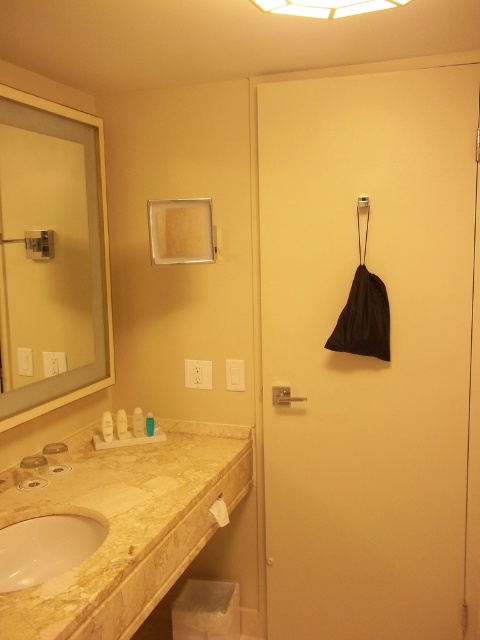
Question: Is matte glass mirror at upper left positioned before marble/granite sink at lower left?

Choices:
 (A) yes
 (B) no

Answer: (B)

Question: Does white plastic bottles at center have a lesser width compared to translucent plastic bottle at upper left?

Choices:
 (A) no
 (B) yes

Answer: (A)

Question: Is white matte towel bar at lower center smaller than translucent plastic bottle at lower left?

Choices:
 (A) yes
 (B) no

Answer: (A)

Question: Which object is positioned farthest from the marble/granite sink at lower left?

Choices:
 (A) white plastic bottles at center
 (B) white matte towel bar at lower center

Answer: (A)

Question: Which of the following is the closest to the observer?

Choices:
 (A) matte silver shower at center
 (B) marble/granite sink at lower left

Answer: (B)

Question: Which of these objects is positioned farthest from the matte silver shower at center?

Choices:
 (A) marble/granite sink at lower left
 (B) translucent plastic bottle at lower left

Answer: (A)